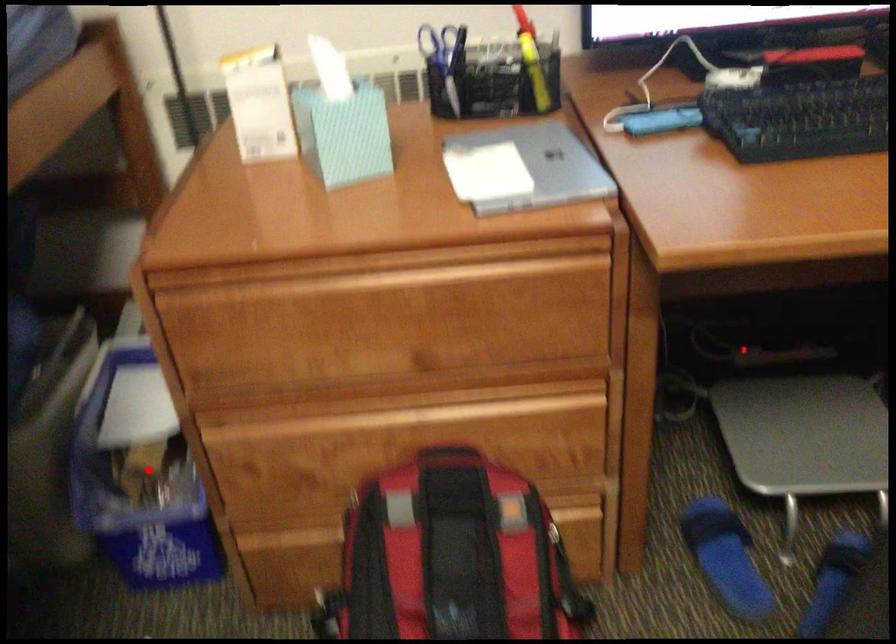
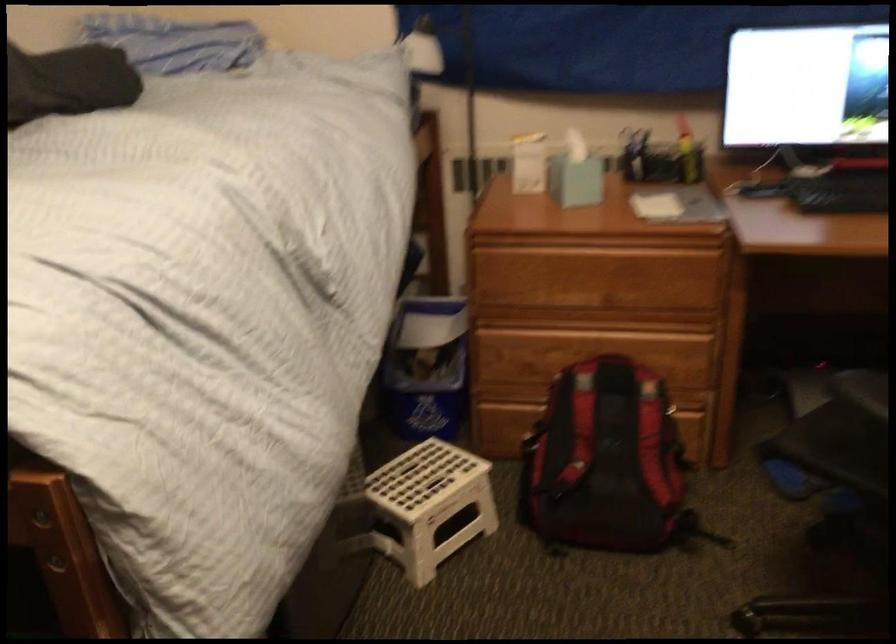
Where in the second image is the point corresponding to the highlighted location from the first image?

(426, 368)